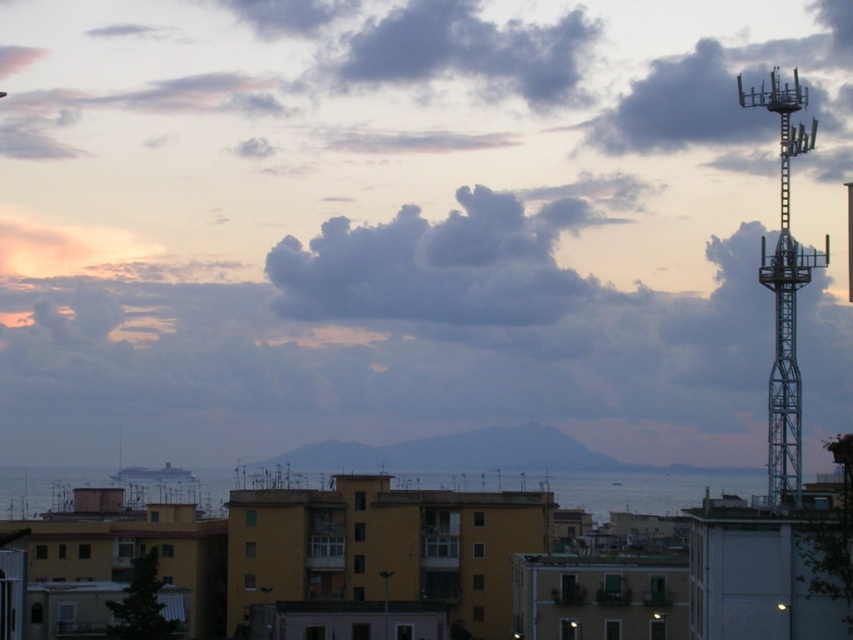
Is metallic silver tower at right bigger than blue metallic cruise ship at lower center?

Yes, metallic silver tower at right is bigger than blue metallic cruise ship at lower center.

Which is more to the left, metallic silver tower at right or blue metallic cruise ship at lower center?

blue metallic cruise ship at lower center is more to the left.

Is point (784, 301) positioned in front of point (155, 480)?

Yes, it is in front of point (155, 480).

Where is `metallic silver tower at right`? Image resolution: width=853 pixels, height=640 pixels. metallic silver tower at right is located at coordinates (784, 296).

Is point (784, 451) behind point (181, 472)?

No.

Where is `metallic silver tower at right`? This screenshot has height=640, width=853. metallic silver tower at right is located at coordinates (784, 296).

Locate an element on the screen. The width and height of the screenshot is (853, 640). metallic silver tower at right is located at coordinates (784, 296).

Between point (790, 131) and point (573, 493), which one is positioned in front?

Point (790, 131)

Is point (775, 483) positioned in front of point (1, 515)?

Yes.

Locate an element on the screen. metallic silver tower at right is located at coordinates (784, 296).